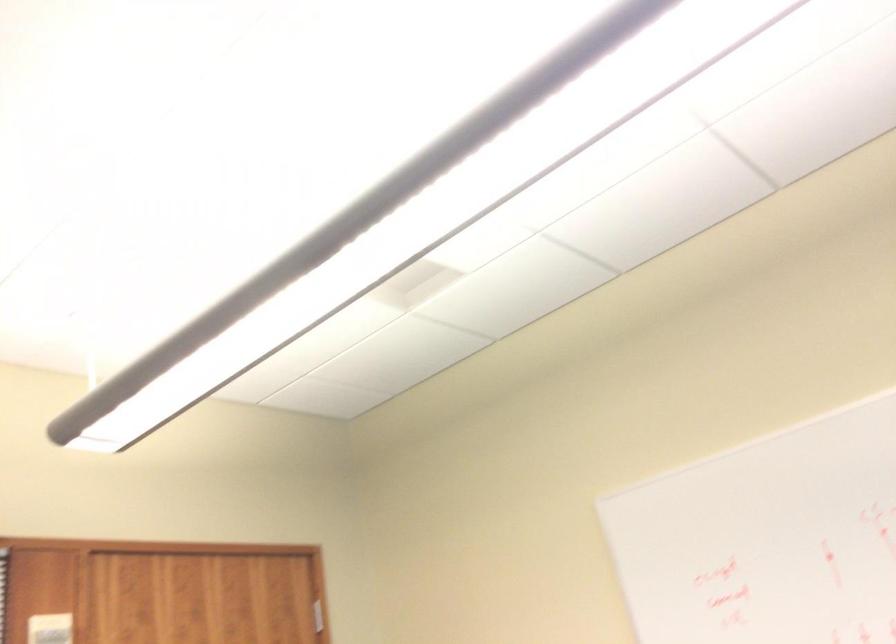
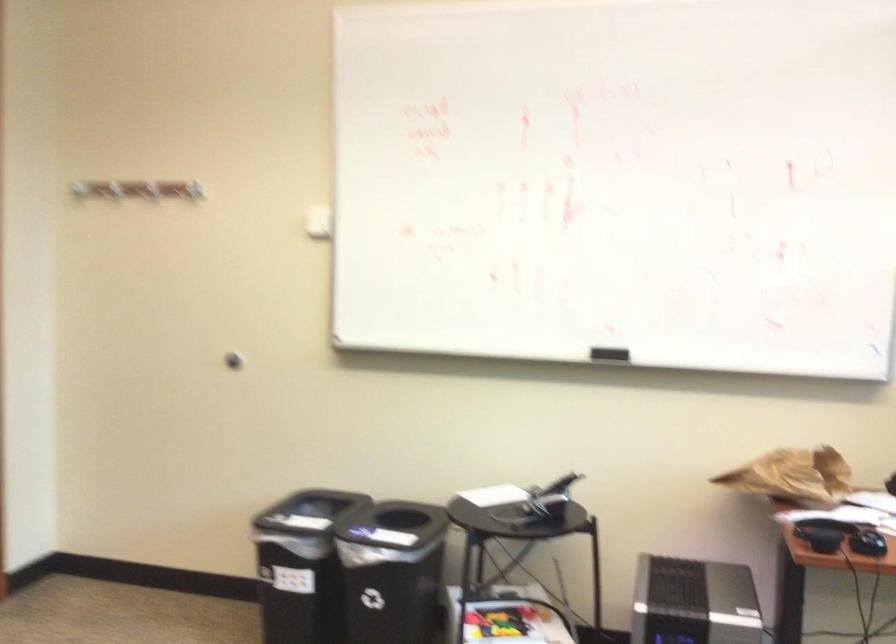
How did the camera likely rotate?

The rotation direction of the camera is right-down.